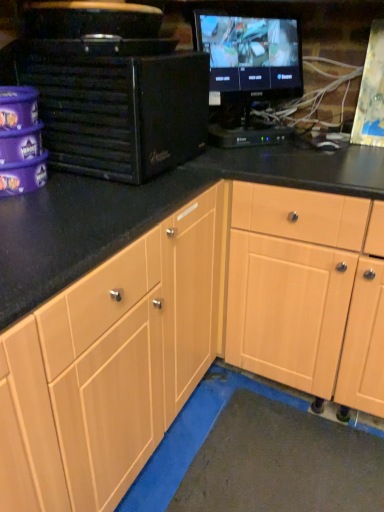
Question: From a real-world perspective, relative to black glossy monitor at upper right, is black matte desktop computer at left vertically above or below?

Choices:
 (A) below
 (B) above

Answer: (A)

Question: From their relative heights in the image, would you say black matte desktop computer at left is taller or shorter than black glossy monitor at upper right?

Choices:
 (A) short
 (B) tall

Answer: (A)

Question: Which is farther from the light wood cabinet at center?

Choices:
 (A) black glossy monitor at upper right
 (B) black matte desktop computer at left

Answer: (A)

Question: Which object is positioned farthest from the black matte desktop computer at left?

Choices:
 (A) light wood cabinet at center
 (B) black glossy monitor at upper right

Answer: (A)